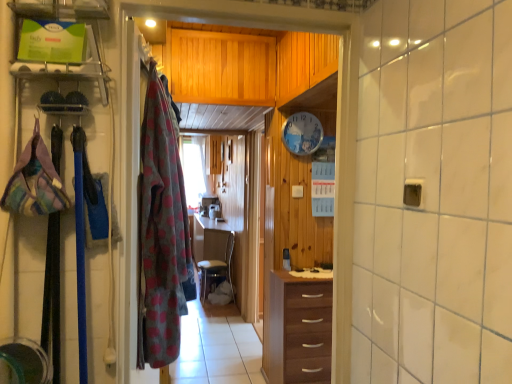
Locate an element on the screen. wooden clock at center is located at coordinates (302, 133).

This screenshot has height=384, width=512. I want to click on brown wood chest of drawers at center, so click(297, 329).

What are the coordinates of `clear plastic shelf at upper left` in the screenshot? It's located at (63, 46).

Is wooden drawer at center to the left of fluffy polka dot blanket at left, the first clothing positioned from the back, from the viewer's perspective?

Yes.

Which of these two, wooden drawer at center or fluffy polka dot blanket at left, which ranks as the 2th clothing in front-to-back order, is thinner?

Thinner between the two is fluffy polka dot blanket at left, which ranks as the 2th clothing in front-to-back order.

Do you think wooden drawer at center is within fluffy polka dot blanket at left, the first clothing viewed from the right, or outside of it?

wooden drawer at center cannot be found inside fluffy polka dot blanket at left, the first clothing viewed from the right.

From the image's perspective, is wooden drawer at center positioned above or below fluffy polka dot blanket at left, the second clothing from the left?

Based on their image positions, wooden drawer at center is located beneath fluffy polka dot blanket at left, the second clothing from the left.

Does fluffy polka dot blanket at left, the second clothing from the left, have a smaller size compared to wooden drawer at center?

Yes.

In the scene shown: Is fluffy polka dot blanket at left, the first clothing positioned from the back, not inside wooden drawer at center?

Yes, fluffy polka dot blanket at left, the first clothing positioned from the back, is located beyond the bounds of wooden drawer at center.

Are fluffy polka dot blanket at left, which ranks as the 2th clothing in front-to-back order, and wooden drawer at center far apart?

Yes, fluffy polka dot blanket at left, which ranks as the 2th clothing in front-to-back order, and wooden drawer at center are quite far apart.

Considering the sizes of objects fluffy polka dot blanket at left, the first clothing viewed from the right, and wooden drawer at center in the image provided, who is shorter, fluffy polka dot blanket at left, the first clothing viewed from the right, or wooden drawer at center?

wooden drawer at center is shorter.

From the image's perspective, who appears lower, wooden clock at center or wooden drawer at center?

wooden drawer at center, from the image's perspective.

Where is `clock to the right of wooden drawer at center`? This screenshot has width=512, height=384. clock to the right of wooden drawer at center is located at coordinates (302, 133).

Considering the relative sizes of wooden clock at center and wooden drawer at center in the image provided, is wooden clock at center smaller than wooden drawer at center?

Yes.

Is there a large distance between wooden clock at center and wooden drawer at center?

Yes, wooden clock at center is far from wooden drawer at center.

Based on the photo, from a real-world perspective, which object rests below the other?

In real-world perspective, fluffy polka dot blanket at left, the second clothing from the left, is lower.

Is wooden clock at center to the right of fluffy polka dot blanket at left, the second clothing from the left, from the viewer's perspective?

Yes, wooden clock at center is to the right of fluffy polka dot blanket at left, the second clothing from the left.

From the image's perspective, starting from the wooden clock at center, which clothing is the 2nd one below? Please provide its 2D coordinates.

[(161, 231)]

Is wooden clock at center oriented away from fluffy polka dot blanket at left, the first clothing positioned from the back?

That's not correct — wooden clock at center is not looking away from fluffy polka dot blanket at left, the first clothing positioned from the back.

Is fluffy polka dot blanket at left, the first clothing viewed from the right, bigger or smaller than brown wood chest of drawers at center?

fluffy polka dot blanket at left, the first clothing viewed from the right, is smaller than brown wood chest of drawers at center.

Based on the photo, does fluffy polka dot blanket at left, the second clothing from the left, have a greater width compared to brown wood chest of drawers at center?

Incorrect, the width of fluffy polka dot blanket at left, the second clothing from the left, does not surpass that of brown wood chest of drawers at center.

Is fluffy polka dot blanket at left, the first clothing positioned from the back, not within brown wood chest of drawers at center?

Yes, fluffy polka dot blanket at left, the first clothing positioned from the back, is located beyond the bounds of brown wood chest of drawers at center.

Considering the positions of objects wooden drawer at center and plaid fabric bag at left, which is the first clothing from front to back, in the image provided, who is more to the right, wooden drawer at center or plaid fabric bag at left, which is the first clothing from front to back,?

Positioned to the right is wooden drawer at center.

What's the angular difference between wooden drawer at center and plaid fabric bag at left, which is the first clothing from front to back,'s facing directions?

There is a 3.65-degree angle between the facing directions of wooden drawer at center and plaid fabric bag at left, which is the first clothing from front to back.

Is wooden drawer at center oriented away from plaid fabric bag at left, positioned as the 2th clothing in back-to-front order?

No, plaid fabric bag at left, positioned as the 2th clothing in back-to-front order, is not at the back of wooden drawer at center.

Which of these two, wooden drawer at center or plaid fabric bag at left, which is the first clothing from front to back, stands taller?

plaid fabric bag at left, which is the first clothing from front to back, is taller.

Would you consider brown wood chest of drawers at center to be distant from wooden drawer at center?

Actually, brown wood chest of drawers at center and wooden drawer at center are a little close together.

Consider the image. How different are the orientations of brown wood chest of drawers at center and wooden drawer at center in degrees?

3.07 degrees.

From the picture: From the image's perspective, which is below, brown wood chest of drawers at center or wooden drawer at center?

wooden drawer at center.

Is brown wood chest of drawers at center outside of wooden drawer at center?

Yes, brown wood chest of drawers at center is outside of wooden drawer at center.

From a real-world perspective, starting from the wooden drawer at center, which clothing is the 1st one vertically above it? Please provide its 2D coordinates.

[(161, 231)]

Identify the location of clothing on the right of wooden drawer at center. (161, 231).

Consider the image. Based on their spatial positions, is plaid fabric bag at left, which ranks as the 2th clothing in right-to-left order, or wooden clock at center further from clear plastic shelf at upper left?

wooden clock at center.

When comparing their distances from wooden clock at center, does clear plastic shelf at upper left or brown wood chest of drawers at center seem further?

clear plastic shelf at upper left is positioned further to the anchor wooden clock at center.

Considering their positions, is plaid fabric bag at left, the 1th clothing from the left, positioned further to wooden drawer at center than fluffy polka dot blanket at left, the first clothing positioned from the back?

The object further to wooden drawer at center is plaid fabric bag at left, the 1th clothing from the left.

From the image, which object appears to be nearer to clear plastic shelf at upper left, fluffy polka dot blanket at left, the second clothing from the left, or wooden clock at center?

fluffy polka dot blanket at left, the second clothing from the left, is positioned closer to the anchor clear plastic shelf at upper left.

Estimate the real-world distances between objects in this image. Which object is further from wooden clock at center, fluffy polka dot blanket at left, the second clothing from the left, or brown wood chest of drawers at center?

fluffy polka dot blanket at left, the second clothing from the left, is further to wooden clock at center.

Estimate the real-world distances between objects in this image. Which object is closer to clear plastic shelf at upper left, wooden clock at center or fluffy polka dot blanket at left, the second clothing from the left?

fluffy polka dot blanket at left, the second clothing from the left, is positioned closer to the anchor clear plastic shelf at upper left.

From the image, which object appears to be farther from wooden clock at center, clear plastic shelf at upper left or plaid fabric bag at left, which is the first clothing from front to back?

plaid fabric bag at left, which is the first clothing from front to back.

When comparing their distances from wooden clock at center, does clear plastic shelf at upper left or wooden drawer at center seem further?

wooden drawer at center lies further to wooden clock at center than the other object.

Where is `chest of drawers between fluffy polka dot blanket at left, the first clothing viewed from the right, and wooden clock at center, along the z-axis`? The width and height of the screenshot is (512, 384). chest of drawers between fluffy polka dot blanket at left, the first clothing viewed from the right, and wooden clock at center, along the z-axis is located at coordinates (297, 329).

Identify the location of clothing between plaid fabric bag at left, the 1th clothing from the left, and wooden drawer at center in the front-back direction. The height and width of the screenshot is (384, 512). (161, 231).

Where is `chest of drawers between plaid fabric bag at left, which is the first clothing from front to back, and wooden clock at center from front to back`? chest of drawers between plaid fabric bag at left, which is the first clothing from front to back, and wooden clock at center from front to back is located at coordinates (297, 329).

The width and height of the screenshot is (512, 384). In order to click on clothing between plaid fabric bag at left, which is the first clothing from front to back, and brown wood chest of drawers at center from front to back in this screenshot , I will do `click(161, 231)`.